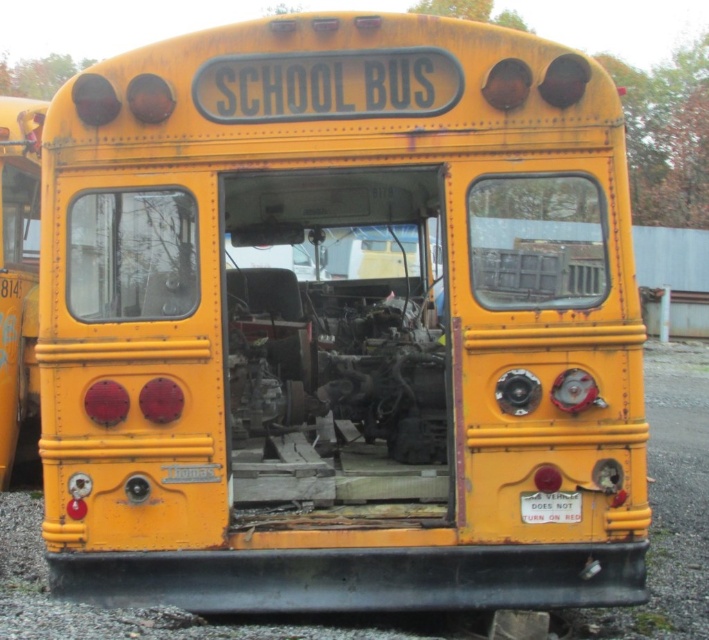
Consider the image. You are a delivery person who needs to park your van next to the matte yellow school bus at left and the metallic gray license plate at center. Since you want to park as close as possible without overlapping, which object should you position your van closer to?

The metallic gray license plate at center is smaller, so you should position your van closer to the metallic gray license plate at center to avoid overlapping with the larger matte yellow school bus at left.

You are standing at a safe distance from the yellow school bus. There is a point at coordinate point (6, 205). If you want to throw a small ball to that point, will it land closer to the bus or further away from it?

The point at coordinate point (6, 205) is 26.09 feet away from the camera. Since you are standing at a safe distance, throwing the ball to that point would land it closer to the bus than where you are standing.

You are a delivery person who needs to deliver a package to the school bus. The package requires a clear path of at least 20 feet to be safely delivered. Given the distance between the matte yellow school bus at left and the metallic gray license plate at center, is the path between them sufficient for the delivery?

The matte yellow school bus at left and the metallic gray license plate at center are 18.38 feet apart, which is less than the required 20 feet. Therefore, the path between them is not sufficient for the delivery.